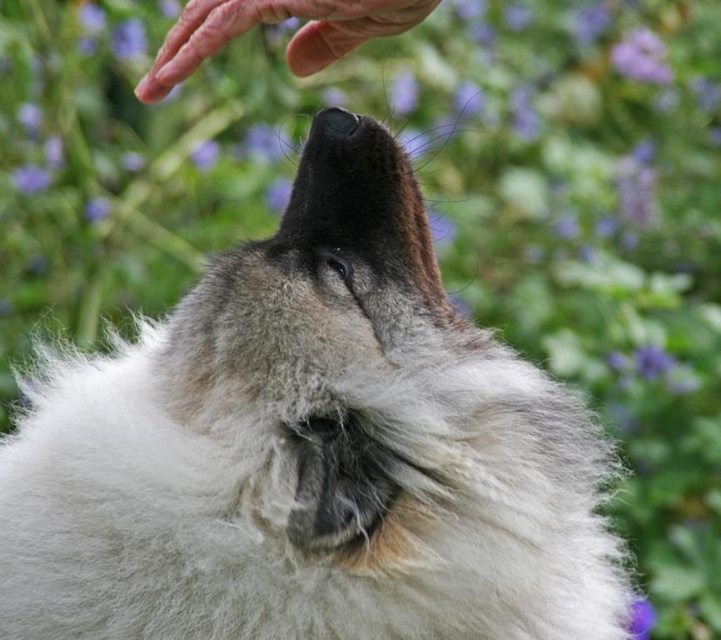
Which of these two, dry skin at upper center or purple matte flower at upper right, stands taller?

purple matte flower at upper right

Is point (311, 3) less distant than point (650, 36)?

Yes, point (311, 3) is in front of point (650, 36).

Is point (198, 44) closer to camera compared to point (645, 44)?

Yes, point (198, 44) is in front of point (645, 44).

At what (x,y) coordinates should I click in order to perform the action: click on dry skin at upper center. Please return your answer as a coordinate pair (x, y). The width and height of the screenshot is (721, 640). Looking at the image, I should click on (275, 22).